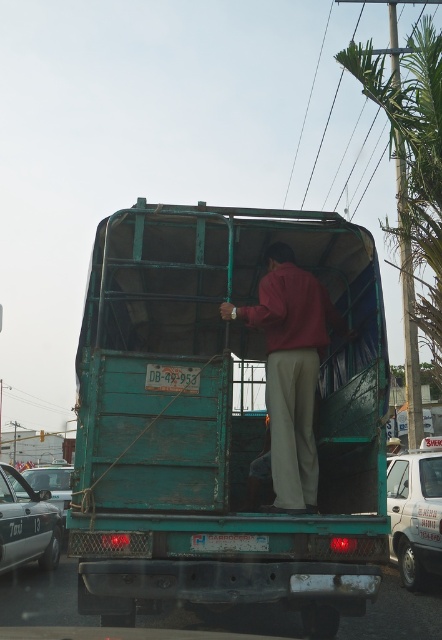
Between green leafy palm tree at upper right and maroon fabric shirt at center, which one appears on the left side from the viewer's perspective?

From the viewer's perspective, maroon fabric shirt at center appears more on the left side.

Find the location of a particular element. The width and height of the screenshot is (442, 640). green leafy palm tree at upper right is located at coordinates 411,180.

The width and height of the screenshot is (442, 640). In order to click on green leafy palm tree at upper right in this screenshot , I will do tap(411, 180).

Can you confirm if teal matte truck at center is thinner than maroon fabric shirt at center?

Incorrect, teal matte truck at center's width is not less than maroon fabric shirt at center's.

Is teal matte truck at center wider than maroon fabric shirt at center?

Correct, the width of teal matte truck at center exceeds that of maroon fabric shirt at center.

Measure the distance between teal matte truck at center and camera.

teal matte truck at center and camera are 4.21 meters apart.

I want to click on teal matte truck at center, so click(x=221, y=419).

Is metallic silver taxi at left bigger than green matte license plate at center?

Correct, metallic silver taxi at left is larger in size than green matte license plate at center.

Does point (19, 548) lie in front of point (209, 547)?

No, it is behind (209, 547).

The image size is (442, 640). What do you see at coordinates (26, 524) in the screenshot?
I see `metallic silver taxi at left` at bounding box center [26, 524].

The height and width of the screenshot is (640, 442). In order to click on metallic silver taxi at left in this screenshot , I will do `click(26, 524)`.